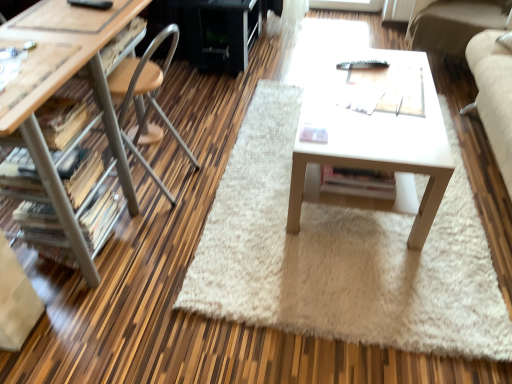
Find the location of a particular element. free region under white shaggy rug at center (from a real-world perspective) is located at coordinates (279, 208).